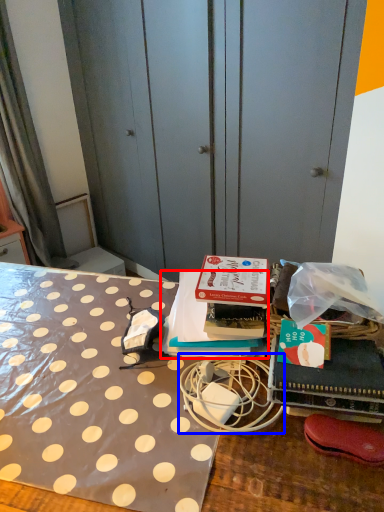
Question: Among these objects, which one is nearest to the camera, book (highlighted by a red box) or twin (highlighted by a blue box)?

Choices:
 (A) book
 (B) twin

Answer: (B)